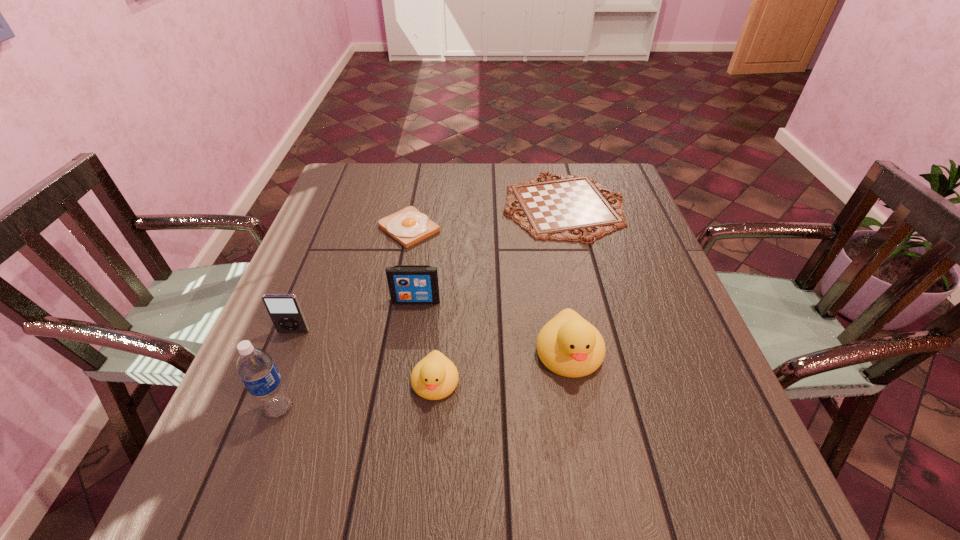
The image size is (960, 540). I want to click on the left duckling, so click(435, 377).

I want to click on the shorter duckling, so click(435, 377).

I want to click on the taller duckling, so click(x=568, y=345).

At what (x,y) coordinates should I click in order to perform the action: click on the fifth nearest object. Please return your answer as a coordinate pair (x, y). Image resolution: width=960 pixels, height=540 pixels. Looking at the image, I should click on (408, 284).

Identify the location of the farther iPod. This screenshot has height=540, width=960. (408, 284).

This screenshot has width=960, height=540. Identify the location of chessboard. (568, 208).

Where is `toast`? toast is located at coordinates (408, 226).

You are a GUI agent. You are given a task and a screenshot of the screen. Output one action in this format:
    pyautogui.click(x=<x>, y=<y>)
    Task: Click on the nearer iPod
    This screenshot has height=540, width=960.
    Given the screenshot: What is the action you would take?
    pyautogui.click(x=284, y=310)

In order to click on the tallest object in this screenshot , I will do `click(256, 368)`.

Where is `free region located on the face of the fifth tallest object`? free region located on the face of the fifth tallest object is located at coordinates (430, 442).